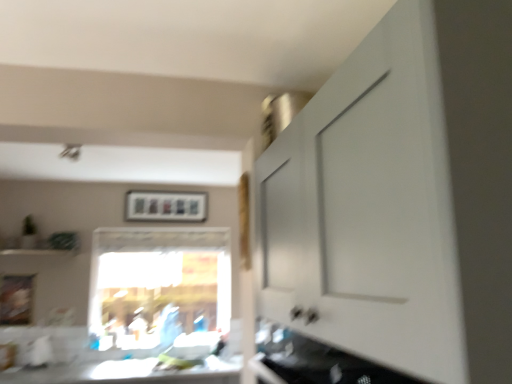
Question: Is transparent glass window at center aimed at white glossy countertop at lower center?

Choices:
 (A) yes
 (B) no

Answer: (A)

Question: From a real-world perspective, is transparent glass window at center on top of white glossy countertop at lower center?

Choices:
 (A) no
 (B) yes

Answer: (B)

Question: Is transparent glass window at center directly adjacent to white glossy countertop at lower center?

Choices:
 (A) yes
 (B) no

Answer: (B)

Question: Is transparent glass window at center positioned before white glossy countertop at lower center?

Choices:
 (A) yes
 (B) no

Answer: (B)

Question: Does transparent glass window at center have a lesser width compared to white glossy countertop at lower center?

Choices:
 (A) no
 (B) yes

Answer: (B)

Question: Considering the positions of transparent glass window at center and matte plastic picture frame at upper center, which is the first picture frame from top to bottom, in the image, is transparent glass window at center bigger or smaller than matte plastic picture frame at upper center, which is the first picture frame from top to bottom,?

Choices:
 (A) small
 (B) big

Answer: (B)

Question: Looking at their shapes, would you say transparent glass window at center is wider or thinner than matte plastic picture frame at upper center, placed as the second picture frame when sorted from front to back?

Choices:
 (A) thin
 (B) wide

Answer: (B)

Question: Is transparent glass window at center to the left or to the right of matte plastic picture frame at upper center, placed as the second picture frame when sorted from front to back, in the image?

Choices:
 (A) right
 (B) left

Answer: (B)

Question: From the image's perspective, is transparent glass window at center positioned above or below matte plastic picture frame at upper center, the first picture frame when ordered from back to front?

Choices:
 (A) below
 (B) above

Answer: (A)

Question: Looking at their shapes, would you say white matte cabinet at upper right, which appears as the first cabinetry when viewed from the top, is wider or thinner than wooden picture frame at lower left, the 1th picture frame viewed from the front?

Choices:
 (A) thin
 (B) wide

Answer: (B)

Question: From a real-world perspective, is white matte cabinet at upper right, which appears as the first cabinetry when viewed from the top, physically located above or below wooden picture frame at lower left, the 1th picture frame viewed from the front?

Choices:
 (A) below
 (B) above

Answer: (B)

Question: In terms of height, does white matte cabinet at upper right, which appears as the first cabinetry when viewed from the top, look taller or shorter compared to wooden picture frame at lower left, arranged as the second picture frame when viewed from the back?

Choices:
 (A) short
 (B) tall

Answer: (B)

Question: From the image's perspective, is white matte cabinet at upper right, which appears as the first cabinetry when viewed from the top, positioned above or below wooden picture frame at lower left, arranged as the 1th picture frame when ordered from the bottom?

Choices:
 (A) below
 (B) above

Answer: (B)

Question: In the image, is white glossy cabinet at lower right, which is the first cabinetry from bottom to top, positioned in front of or behind matte plastic picture frame at upper center, which is the 2th picture frame from bottom to top?

Choices:
 (A) behind
 (B) front

Answer: (B)

Question: From a real-world perspective, is white glossy cabinet at lower right, which is the first cabinetry from bottom to top, physically located above or below matte plastic picture frame at upper center, the 2th picture frame positioned from the left?

Choices:
 (A) above
 (B) below

Answer: (B)